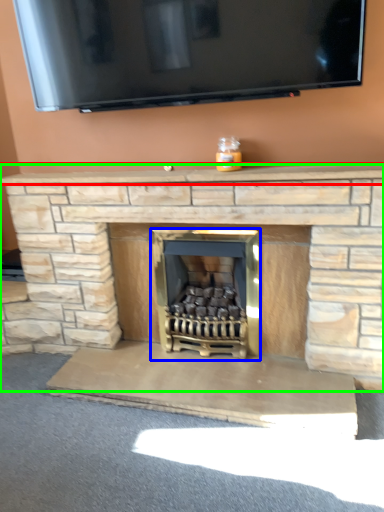
Question: Which object is the farthest from mantle (highlighted by a red box)? Choose among these: wood burning stove (highlighted by a blue box) or fireplace (highlighted by a green box).

Choices:
 (A) wood burning stove
 (B) fireplace

Answer: (A)